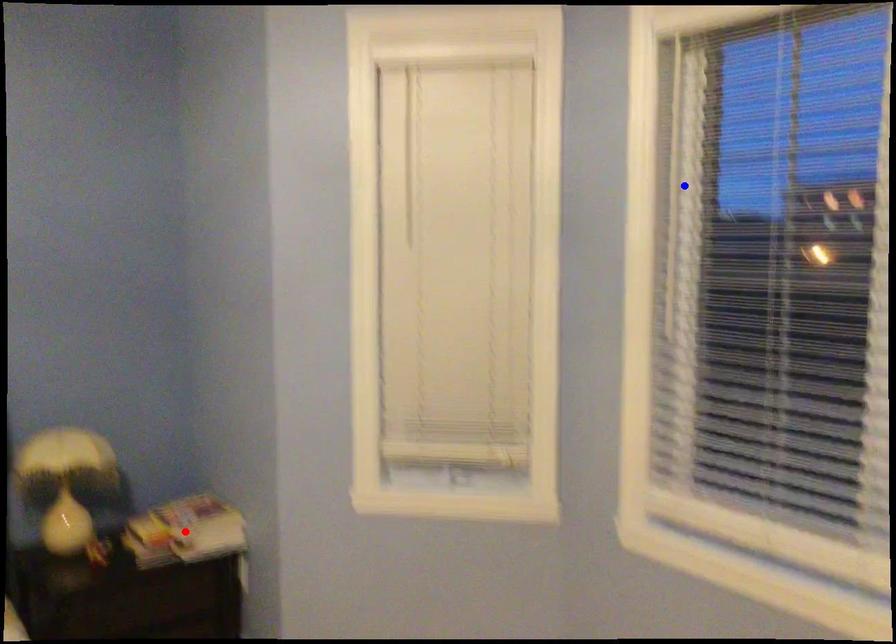
Question: Two points are marked on the image. Which point is closer to the camera?

Choices:
 (A) Blue point is closer.
 (B) Red point is closer.

Answer: (A)